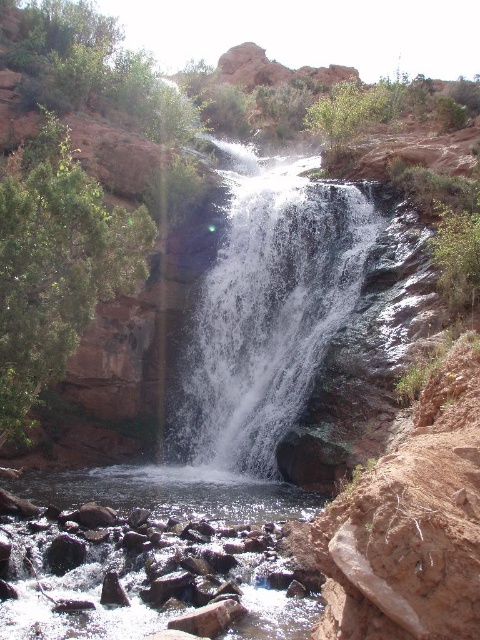
You are standing at the edge of the cliff overlooking the waterfall. If you want to take a photo of the white frothy water at center, where should you aim your camera relative to your position?

The white frothy water at center is located at point coordinates approximately 0.484 on the x and 0.558 on the y axis. To capture it, aim your camera slightly to the right and above your current position based on the coordinates provided.

You are a photographer planning to capture the waterfall scene. You notice two distinct water areas in the image. The first is the white frothy water at center, and the second is the clear water at center. Which of these two water areas would you focus on to highlight the powerful flow of the waterfall in your photo?

The white frothy water at center is larger in size than the clear water at center, so focusing on the white frothy water at center would better emphasize the powerful flow of the waterfall due to its prominent and dynamic appearance.

You are a hiker who wants to cross the river at the bottom of the waterfall. The white frothy water at center is too turbulent to walk through. Can you safely walk across the clear water at center instead?

The distance between the white frothy water at center and clear water at center is 62.51 feet. Since the clear water at center is farther away, you would need to find another path to cross safely as the distance is too large to step over.